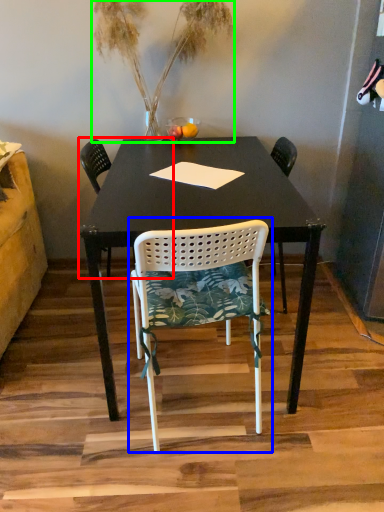
Question: Considering the real-world distances, which object is closest to chair (highlighted by a red box)? chair (highlighted by a blue box) or houseplant (highlighted by a green box).

Choices:
 (A) chair
 (B) houseplant

Answer: (B)